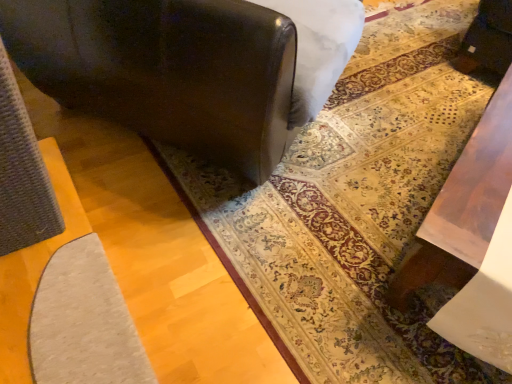
Question: Is matte gray rug at center closer to camera compared to matte black sofa at center?

Choices:
 (A) no
 (B) yes

Answer: (A)

Question: From a real-world perspective, does matte gray rug at center sit lower than matte black sofa at center?

Choices:
 (A) no
 (B) yes

Answer: (B)

Question: From a real-world perspective, does matte gray rug at center stand above matte black sofa at center?

Choices:
 (A) no
 (B) yes

Answer: (A)

Question: Are matte gray rug at center and matte black sofa at center located far from each other?

Choices:
 (A) yes
 (B) no

Answer: (B)

Question: Is matte gray rug at center positioned beyond the bounds of matte black sofa at center?

Choices:
 (A) no
 (B) yes

Answer: (B)

Question: Does matte gray rug at center have a lesser width compared to matte black sofa at center?

Choices:
 (A) no
 (B) yes

Answer: (A)

Question: From a real-world perspective, is matte black sofa at center over matte gray rug at center?

Choices:
 (A) no
 (B) yes

Answer: (B)

Question: Considering the relative positions of matte black sofa at center and matte gray rug at center in the image provided, is matte black sofa at center to the left of matte gray rug at center from the viewer's perspective?

Choices:
 (A) no
 (B) yes

Answer: (B)

Question: Is matte black sofa at center facing towards matte gray rug at center?

Choices:
 (A) no
 (B) yes

Answer: (B)

Question: Does matte black sofa at center have a greater height compared to matte gray rug at center?

Choices:
 (A) no
 (B) yes

Answer: (B)

Question: From a real-world perspective, is matte black sofa at center below matte gray rug at center?

Choices:
 (A) yes
 (B) no

Answer: (B)

Question: From the image's perspective, is matte black sofa at center on top of matte gray rug at center?

Choices:
 (A) yes
 (B) no

Answer: (A)

Question: Considering the positions of matte black sofa at center and matte gray rug at center in the image, is matte black sofa at center bigger or smaller than matte gray rug at center?

Choices:
 (A) big
 (B) small

Answer: (A)